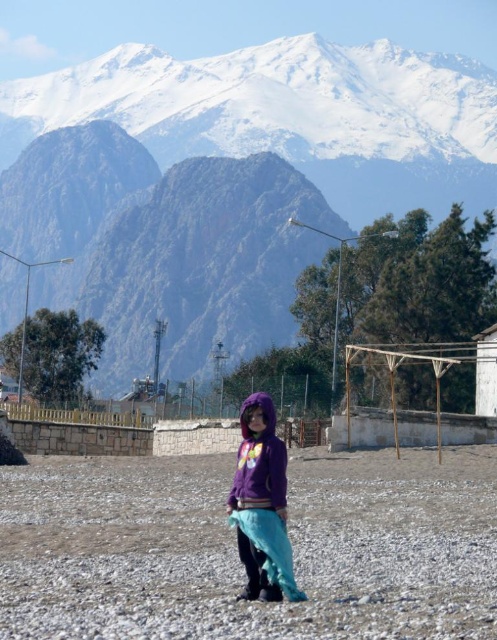
You are a photographer planning to take a photo of the dusty gravel at center and the purple fleece hoodie at center in the mountain scene. Based on their heights, which object would you focus on first if you want to ensure both are in sharp focus?

The dusty gravel at center has a lesser height compared to purple fleece hoodie at center. Since the gravel is lower, you should focus on the purple fleece hoodie at center first to ensure both are in sharp focus.

You are a photographer wanting to capture both the purple fleece hoodie at center and the white painted wood hut at right in the same frame. Given their sizes, which object should you focus on first to ensure both are in the frame?

The purple fleece hoodie at center has a smaller size compared to the white painted wood hut at right. To ensure both are in the frame, focus on the white painted wood hut at right first since it is larger and will require more space in the composition.

You are a photographer trying to capture the purple fleece hoodie at center and the white painted wood hut at right in the same frame. Based on their positions, which object should you adjust your camera to focus on first to ensure both are in the shot?

The purple fleece hoodie at center is to the left of the white painted wood hut at right, so you should focus on the white painted wood hut at right first to ensure both are in the frame.